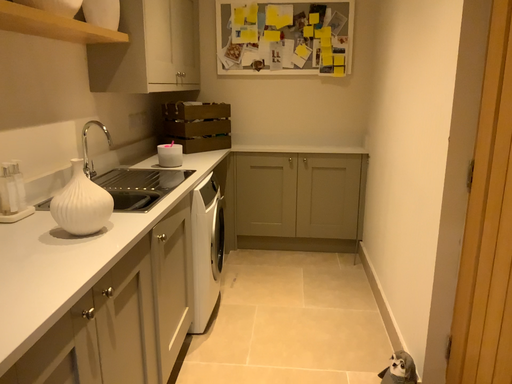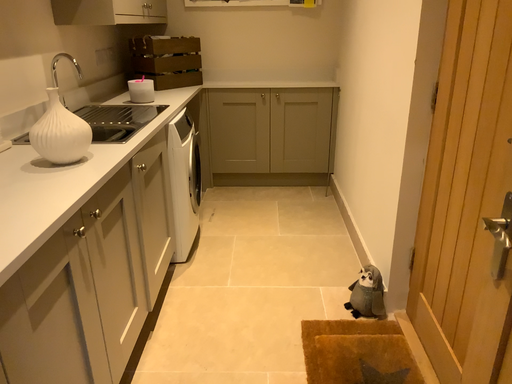
Question: How did the camera likely rotate when shooting the video?

Choices:
 (A) rotated upward
 (B) rotated downward

Answer: (B)